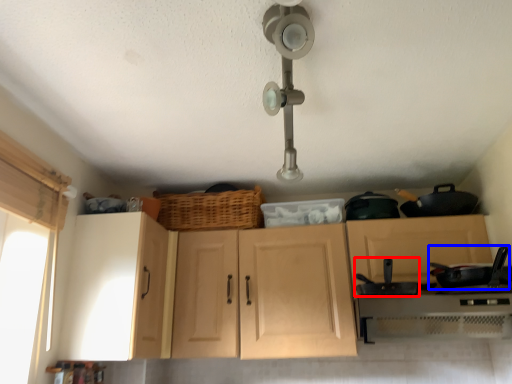
Question: Among these objects, which one is farthest to the camera, frying pan (highlighted by a red box) or frying pan (highlighted by a blue box)?

Choices:
 (A) frying pan
 (B) frying pan

Answer: (B)